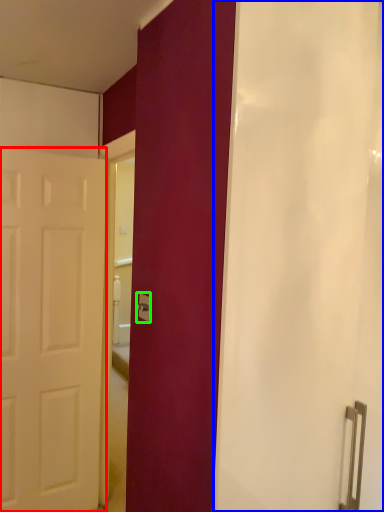
Question: Which object is positioned closest to door (highlighted by a red box)? Select from shower curtain (highlighted by a blue box) and electric outlet (highlighted by a green box).

Choices:
 (A) shower curtain
 (B) electric outlet

Answer: (B)